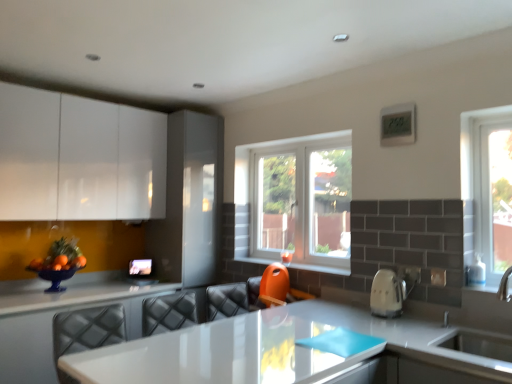
The image size is (512, 384). Identify the location of white glossy electric kettle at right. (387, 294).

The width and height of the screenshot is (512, 384). Identify the location of white glossy cabinets at upper left. (79, 158).

Describe the element at coordinates (79, 158) in the screenshot. I see `white glossy cabinets at upper left` at that location.

What do you see at coordinates (273, 288) in the screenshot? The image size is (512, 384). I see `orange plastic swivel chair at center` at bounding box center [273, 288].

Where is `white glossy countertop at lower center`? white glossy countertop at lower center is located at coordinates (53, 316).

Locate an element on the screen. This screenshot has width=512, height=384. white glossy table at center is located at coordinates (228, 353).

Where is `white glossy electric kettle at right`? Image resolution: width=512 pixels, height=384 pixels. white glossy electric kettle at right is located at coordinates (387, 294).

From a real-world perspective, is white glossy cabinets at upper left physically below white glossy countertop at lower center?

No, from a real-world perspective, white glossy cabinets at upper left is not below white glossy countertop at lower center.

Is white glossy cabinets at upper left taller than white glossy countertop at lower center?

Yes.

Is white glossy countertop at lower center surrounded by white glossy cabinets at upper left?

Actually, white glossy countertop at lower center is outside white glossy cabinets at upper left.

The width and height of the screenshot is (512, 384). In order to click on cabinetry above the white glossy countertop at lower center (from the image's perspective) in this screenshot , I will do `click(79, 158)`.

Which is behind, orange plastic at center or orange plastic swivel chair at center?

orange plastic at center is further away from the camera.

Can you confirm if orange plastic at center is bigger than orange plastic swivel chair at center?

No, orange plastic at center is not bigger than orange plastic swivel chair at center.

Does orange plastic at center have a greater height compared to orange plastic swivel chair at center?

Incorrect, the height of orange plastic at center is not larger of that of orange plastic swivel chair at center.

From a real-world perspective, is white glossy cabinets at upper left positioned over white plastic window at center based on gravity?

Indeed, from a real-world perspective, white glossy cabinets at upper left stands above white plastic window at center.

Which is nearer, (67, 184) or (254, 238)?

The point (67, 184) is closer to the camera.

Is white plastic window at center at the back of white glossy cabinets at upper left?

No, white glossy cabinets at upper left is not facing the opposite direction of white plastic window at center.

Would you say white plastic window at center is part of white glossy cabinets at upper left's contents?

No, white glossy cabinets at upper left does not contain white plastic window at center.

Are orange plastic at center and white glossy electric kettle at right far apart?

Actually, orange plastic at center and white glossy electric kettle at right are a little close together.

Looking at this image, considering the positions of objects orange plastic at center and white glossy electric kettle at right in the image provided, who is in front, orange plastic at center or white glossy electric kettle at right?

white glossy electric kettle at right is in front.

The width and height of the screenshot is (512, 384). In order to click on window sill behind the white glossy electric kettle at right in this screenshot , I will do `click(319, 268)`.

Does point (286, 264) lie behind point (373, 299)?

Yes, it is behind point (373, 299).

Looking at this image, can you confirm if orange plastic at center is shorter than white glossy table at center?

Indeed, orange plastic at center has a lesser height compared to white glossy table at center.

Considering the relative positions of orange plastic at center and white glossy table at center in the image provided, is orange plastic at center to the right of white glossy table at center from the viewer's perspective?

Yes, orange plastic at center is to the right of white glossy table at center.

How many degrees apart are the facing directions of orange plastic at center and white glossy table at center?

89.9 degrees separate the facing orientations of orange plastic at center and white glossy table at center.

Which point is more forward, [254,260] or [280,311]?

The point [280,311] is more forward.

From a real-world perspective, relative to white glossy electric kettle at right, is white glossy cabinets at upper left vertically above or below?

white glossy cabinets at upper left is above white glossy electric kettle at right.

Can you see white glossy cabinets at upper left touching white glossy electric kettle at right?

white glossy cabinets at upper left and white glossy electric kettle at right are clearly separated.

Is point (75, 180) in front of point (394, 288)?

No, (75, 180) is further to viewer.

From the image's perspective, is white glossy cabinets at upper left above or below white glossy electric kettle at right?

Clearly, from the image's perspective, white glossy cabinets at upper left is above white glossy electric kettle at right.

Is white glossy sink at lower right with white glossy countertop at lower center?

No, white glossy sink at lower right is not with white glossy countertop at lower center.

Is white glossy sink at lower right positioned before white glossy countertop at lower center?

Yes, white glossy sink at lower right is closer to the viewer.

Is white glossy sink at lower right completely or partially outside of white glossy countertop at lower center?

Yes, white glossy sink at lower right is outside of white glossy countertop at lower center.

Based on the photo, from a real-world perspective, is white glossy sink at lower right on white glossy countertop at lower center?

Indeed, from a real-world perspective, white glossy sink at lower right stands above white glossy countertop at lower center.

Identify the location of cabinetry behind the white glossy countertop at lower center. (79, 158).

The image size is (512, 384). Find the location of `swivel chair on the left of the orange plastic at center`. swivel chair on the left of the orange plastic at center is located at coordinates (273, 288).

Which object lies further to the anchor point orange plastic swivel chair at center, orange plastic at center or white glossy table at center?

Among the two, white glossy table at center is located further to orange plastic swivel chair at center.

Consider the image. Looking at the image, which one is located further to white glossy electric kettle at right, white glossy sink at lower right or white glossy countertop at lower center?

white glossy countertop at lower center.

Looking at the image, which one is located closer to orange plastic at center, white glossy table at center or white glossy electric kettle at right?

white glossy electric kettle at right is positioned closer to the anchor orange plastic at center.

When comparing their distances from white glossy countertop at lower center, does white glossy electric kettle at right or orange plastic at center seem closer?

orange plastic at center.

Which object lies nearer to the anchor point white glossy cabinets at upper left, orange plastic swivel chair at center or white glossy table at center?

orange plastic swivel chair at center is closer to white glossy cabinets at upper left.

Estimate the real-world distances between objects in this image. Which object is further from orange plastic at center, white glossy sink at lower right or white glossy countertop at lower center?

white glossy countertop at lower center.

From the picture: From the image, which object appears to be farther from orange plastic swivel chair at center, white glossy countertop at lower center or white glossy table at center?

Based on the image, white glossy countertop at lower center appears to be further to orange plastic swivel chair at center.

When comparing their distances from white glossy electric kettle at right, does white glossy countertop at lower center or white glossy sink at lower right seem further?

white glossy countertop at lower center is further to white glossy electric kettle at right.

The width and height of the screenshot is (512, 384). In order to click on countertop between white glossy cabinets at upper left and white glossy sink at lower right in this screenshot , I will do `click(53, 316)`.

The width and height of the screenshot is (512, 384). In order to click on window sill located between white glossy cabinets at upper left and white glossy electric kettle at right in the left-right direction in this screenshot , I will do `click(319, 268)`.

Where is `appliance between white glossy table at center and white plastic window at center in the front-back direction`? Image resolution: width=512 pixels, height=384 pixels. appliance between white glossy table at center and white plastic window at center in the front-back direction is located at coordinates [x=387, y=294].

Where is `swivel chair between white glossy countertop at lower center and white glossy sink at lower right`? The image size is (512, 384). swivel chair between white glossy countertop at lower center and white glossy sink at lower right is located at coordinates (273, 288).